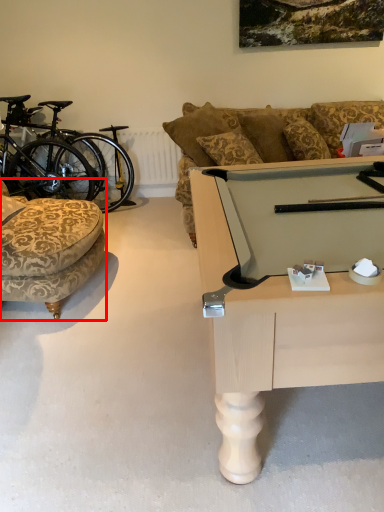
Question: From the image's perspective, where is chair (annotated by the red box) located in relation to bicycle in the image?

Choices:
 (A) above
 (B) below

Answer: (B)